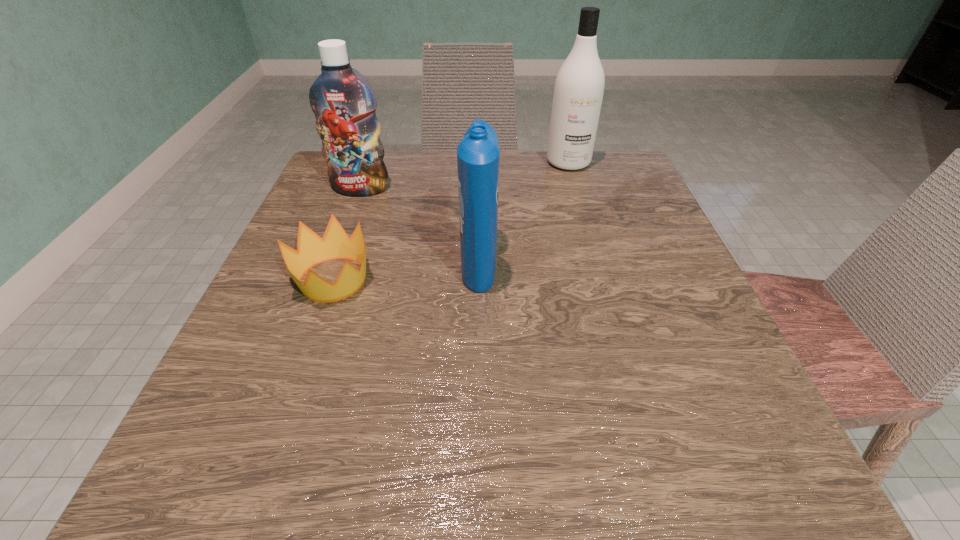
The image size is (960, 540). In order to click on free space at the far right corner of the desktop in this screenshot , I will do `click(626, 150)`.

Locate an element on the screen. The height and width of the screenshot is (540, 960). unoccupied position between the shortest object and the second shampoo from right to left is located at coordinates coord(406,271).

This screenshot has height=540, width=960. Identify the location of vacant region between the leftmost shampoo and the shortest object. (348, 234).

The width and height of the screenshot is (960, 540). I want to click on free space that is in between the shortest object and the nearest shampoo, so click(406, 271).

You are a GUI agent. You are given a task and a screenshot of the screen. Output one action in this format:
    pyautogui.click(x=<x>, y=<y>)
    Task: Click on the vacant space in between the second farthest shampoo and the second shampoo from right to left
    This screenshot has height=540, width=960.
    Given the screenshot: What is the action you would take?
    pyautogui.click(x=420, y=226)

Image resolution: width=960 pixels, height=540 pixels. I want to click on vacant region between the third object from left to right and the rightmost shampoo, so click(x=524, y=213).

At what (x,y) coordinates should I click in order to perform the action: click on vacant space that is in between the second object from right to left and the rightmost object. Please return your answer as a coordinate pair (x, y). This screenshot has height=540, width=960. Looking at the image, I should click on (524, 213).

In order to click on free space that is in between the crown and the rightmost object in this screenshot , I will do `click(451, 221)`.

Find the location of a particular element. object that is the third closest one to the farthest shampoo is located at coordinates (311, 249).

Locate an element on the screen. The width and height of the screenshot is (960, 540). object that stands as the third closest to the nearest shampoo is located at coordinates (579, 86).